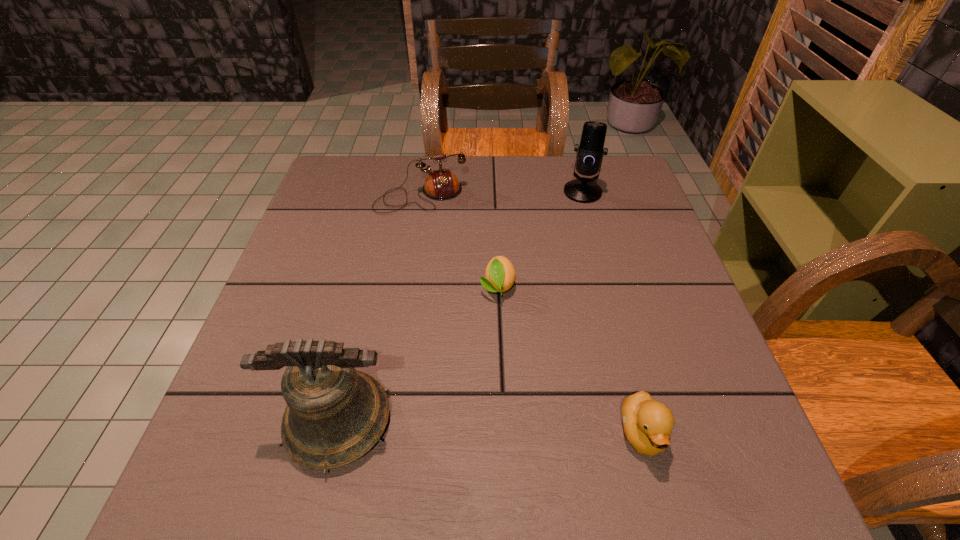
Find the location of a particular element. Image resolution: width=960 pixels, height=540 pixels. empty location between the microphone and the telephone is located at coordinates (502, 194).

Locate which object ranks fourth in proximity to the microphone. Please provide its 2D coordinates. Your answer should be formatted as a tuple, i.e. [(x, y)], where the tuple contains the x and y coordinates of a point satisfying the conditions above.

[(335, 414)]

Identify the location of the closest object relative to the telephone. This screenshot has width=960, height=540. (500, 274).

I want to click on free location that satisfies the following two spatial constraints: 1. on the back side of the telephone; 2. on the right side of the microphone, so click(421, 192).

Locate an element on the screen. The width and height of the screenshot is (960, 540). vacant space that satisfies the following two spatial constraints: 1. on the back side of the telephone; 2. on the right side of the microphone is located at coordinates point(421,192).

Where is `vacant position in the image that satisfies the following two spatial constraints: 1. on the back side of the bell; 2. on the left side of the third object from right to left`? This screenshot has height=540, width=960. vacant position in the image that satisfies the following two spatial constraints: 1. on the back side of the bell; 2. on the left side of the third object from right to left is located at coordinates (371, 286).